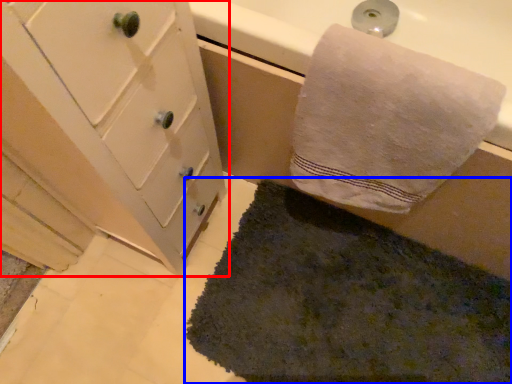
Question: Which point is further to the camera, bathroom cabinet (highlighted by a red box) or bath mat (highlighted by a blue box)?

Choices:
 (A) bathroom cabinet
 (B) bath mat

Answer: (B)